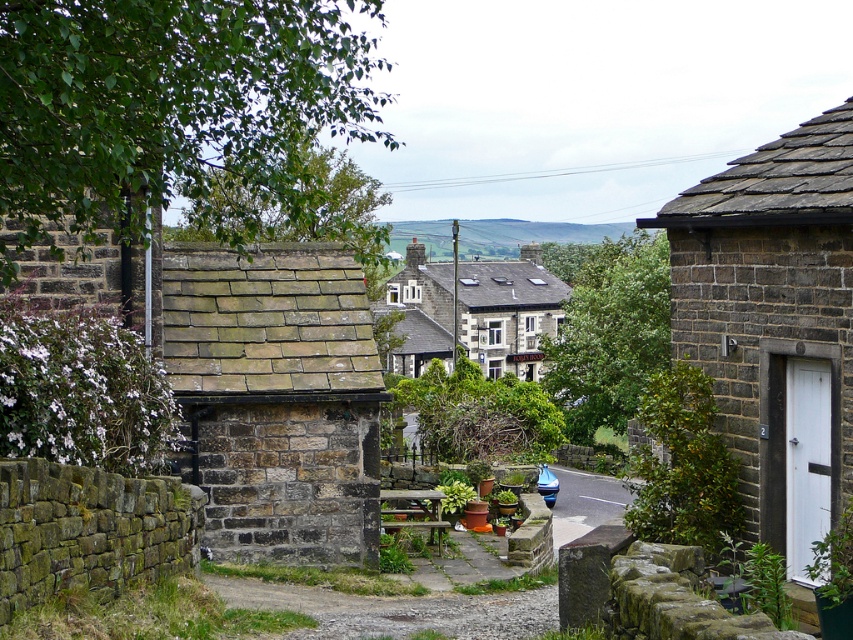
Question: Does rustic stone cottage at left lie behind dark gray stone cottage at center?

Choices:
 (A) yes
 (B) no

Answer: (B)

Question: Based on their relative distances, which object is nearer to the rustic stone cottage at left?

Choices:
 (A) matte stone cottage at right
 (B) dark gray stone cottage at center

Answer: (A)

Question: Considering the real-world distances, which object is farthest from the rustic stone cottage at left?

Choices:
 (A) dark gray stone cottage at center
 (B) matte stone cottage at right

Answer: (A)

Question: Does rustic stone cottage at left appear on the left side of matte stone cottage at right?

Choices:
 (A) no
 (B) yes

Answer: (B)

Question: Which object is closer to the camera taking this photo?

Choices:
 (A) rustic stone cottage at left
 (B) matte stone cottage at right

Answer: (A)

Question: Is matte stone cottage at right above dark gray stone cottage at center?

Choices:
 (A) yes
 (B) no

Answer: (A)